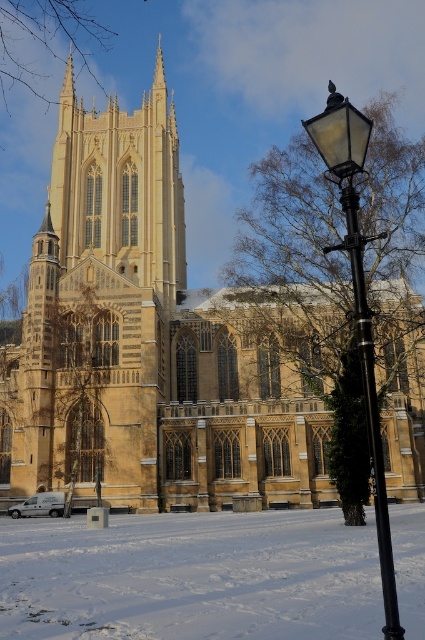
You are a photographer standing in front of the cathedral. You want to capture a photo that includes both the white powdery snow at lower left and the golden stone tower at upper center. Which object should you position closer to the left side of your camera frame?

The white powdery snow at lower left should be positioned closer to the left side of your camera frame because it is located to the right of the golden stone tower at upper center, meaning the tower is actually positioned more to the left relative to the snow.

You are an architect analyzing the symmetry of the cathedral. Which object, the golden stone tower at upper center or the black polished metal streetlight at right, has a narrower width?

The golden stone tower at upper center is thinner than the black polished metal streetlight at right, so it has a narrower width.